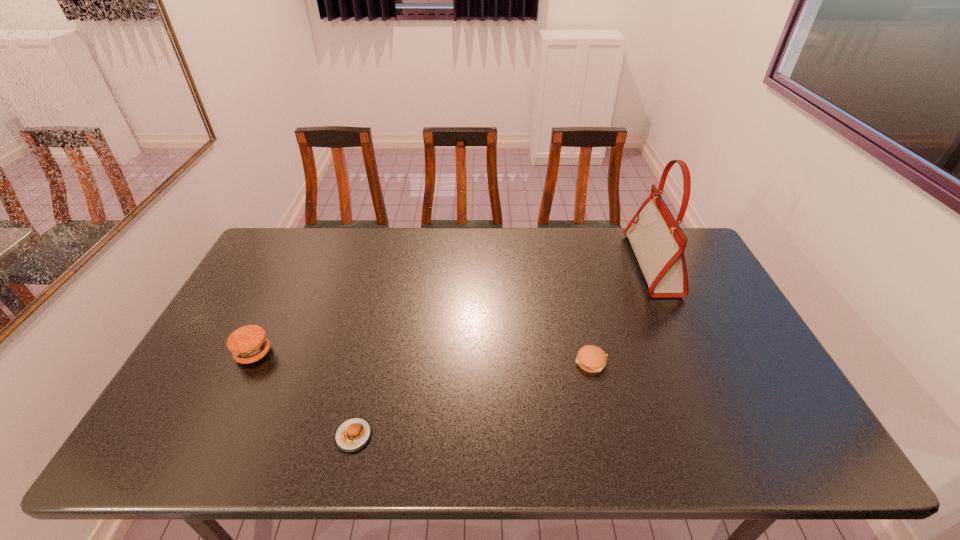
Where is `vacant space at the far left corner of the desktop`? The width and height of the screenshot is (960, 540). vacant space at the far left corner of the desktop is located at coordinates (276, 246).

This screenshot has width=960, height=540. In order to click on free space at the near right corner of the desktop in this screenshot , I will do `click(749, 453)`.

Find the location of `vacant space that's between the tallest object and the second food from right to left`. vacant space that's between the tallest object and the second food from right to left is located at coordinates (503, 350).

Where is `empty location between the leftmost object and the rightmost food`? The height and width of the screenshot is (540, 960). empty location between the leftmost object and the rightmost food is located at coordinates (422, 357).

This screenshot has width=960, height=540. Identify the location of empty space between the nearest food and the second tallest food. coord(472,399).

Image resolution: width=960 pixels, height=540 pixels. Find the location of `free space between the rightmost object and the rightmost food`. free space between the rightmost object and the rightmost food is located at coordinates (621, 313).

At what (x,y) coordinates should I click in order to perform the action: click on blank region between the leftmost food and the third tallest object. Please return your answer as a coordinate pair (x, y). Looking at the image, I should click on (422, 357).

You are a GUI agent. You are given a task and a screenshot of the screen. Output one action in this format:
    pyautogui.click(x=<x>, y=<y>)
    Task: Click on the empty location between the second object from left to right and the second tallest object
    This screenshot has height=540, width=960.
    Given the screenshot: What is the action you would take?
    pyautogui.click(x=303, y=395)

This screenshot has height=540, width=960. I want to click on unoccupied position between the second shortest object and the rightmost object, so click(x=621, y=313).

This screenshot has height=540, width=960. Find the location of `free space between the rightmost food and the farthest object`. free space between the rightmost food and the farthest object is located at coordinates (621, 313).